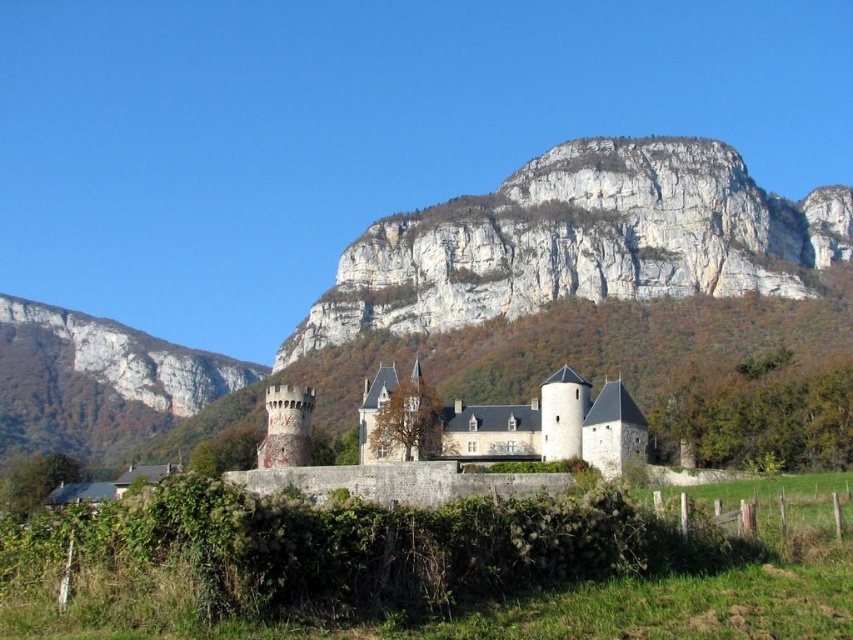
You are an architect examining the castle grounds. You notice the white rock cliff at upper center and the smooth gray rock at left. Which rock would you estimate has a bigger volume based on their sizes?

The white rock cliff at upper center has a larger size compared to the smooth gray rock at left, so it would have a bigger volume.

You are a hiker standing at the base of the castle grounds and want to reach the white rock cliff at upper center. According to the map, the coordinates of the cliff are point (581,241). Which direction should you head towards from your current position?

The white rock cliff at upper center is located at point (581,241), so you should head towards the upper center direction from your current position at the base of the castle grounds.

You are a tourist visiting the castle and want to take a photo that includes both the smooth gray rock at left and the central tower. Based on their positions, where should you stand to ensure both are in the frame?

To include both the smooth gray rock at left and the central tower in your photo, you should position yourself to the left side of the scene, as the smooth gray rock at left is located at point (97, 381), which is towards the left edge. This placement allows the central tower, being the main structure in the center, to remain within the frame while capturing the rock on the left side.